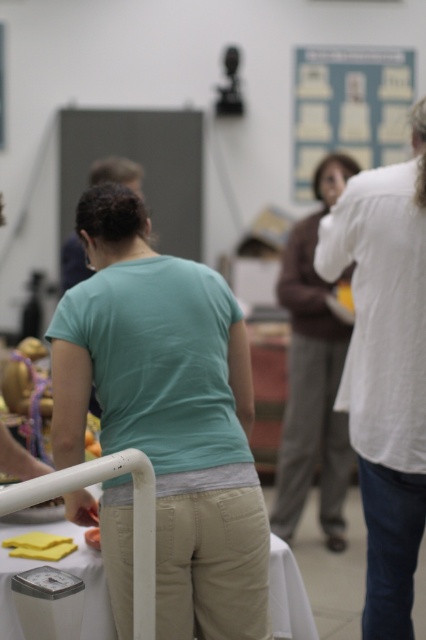
Question: Which object is farther from the camera taking this photo?

Choices:
 (A) blue paperboard at upper center
 (B) white plastic table at center
 (C) teal matte shirt at center

Answer: (A)

Question: Can you confirm if white cotton shirt at right is thinner than blue paperboard at upper center?

Choices:
 (A) no
 (B) yes

Answer: (B)

Question: Does white cotton shirt at right appear under matte brown sweater at center?

Choices:
 (A) yes
 (B) no

Answer: (A)

Question: Which of the following is the closest to the observer?

Choices:
 (A) blue paperboard at upper center
 (B) matte brown sweater at center
 (C) white cotton shirt at right

Answer: (C)

Question: Estimate the real-world distances between objects in this image. Which object is closer to the white cotton shirt at right?

Choices:
 (A) matte brown sweater at center
 (B) teal matte shirt at center
 (C) white plastic table at center
 (D) blue paperboard at upper center

Answer: (B)

Question: Can you confirm if white cotton shirt at right is bigger than matte brown sweater at center?

Choices:
 (A) no
 (B) yes

Answer: (A)